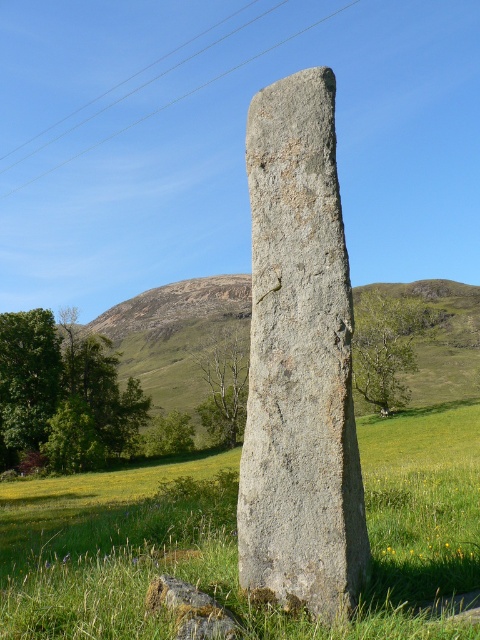
You are standing at the center of the image and want to place a small decorative stone on the green grassy area at center. According to the coordinates provided, is the green grassy at center positioned to the left or right of the center point?

The green grassy at center is located at point 0.842 on the x and 0.492 on the y. Since the x coordinate is greater than 0.5, it is positioned to the right of the center point.